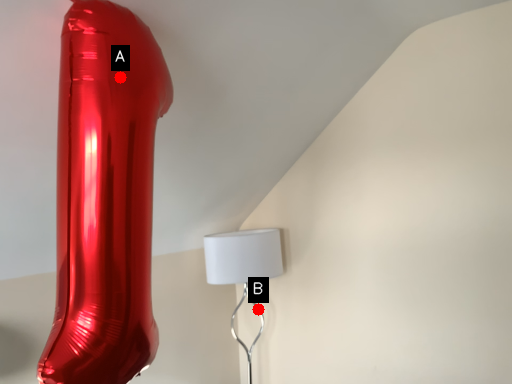
Question: Two points are circled on the image, labeled by A and B beside each circle. Among these points, which one is farthest from the camera?

Choices:
 (A) A is further
 (B) B is further

Answer: (B)